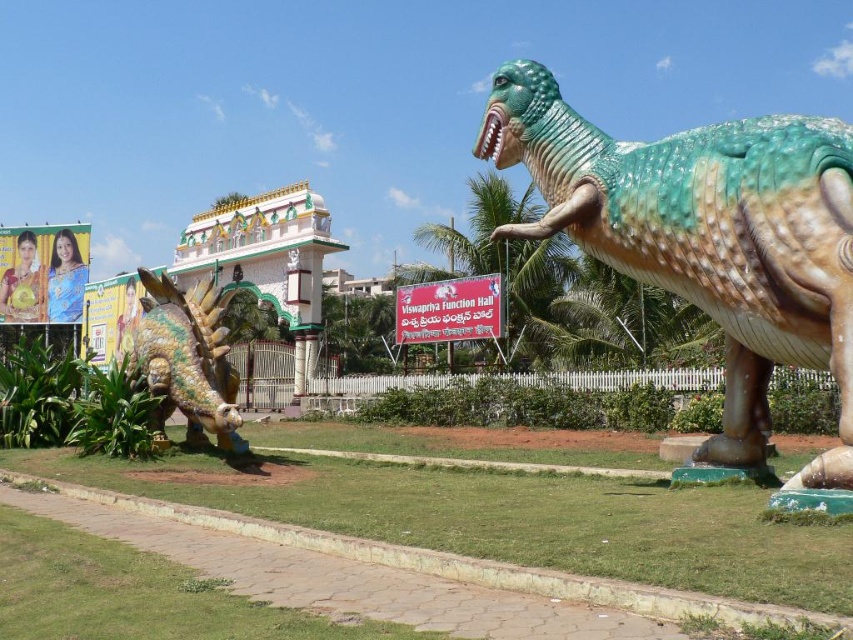
Is shiny green plastic dinosaur at right to the right of shiny gold plated dragon at center from the viewer's perspective?

Yes, shiny green plastic dinosaur at right is to the right of shiny gold plated dragon at center.

Does point (828, 360) lie in front of point (175, 307)?

Yes.

This screenshot has height=640, width=853. I want to click on shiny green plastic dinosaur at right, so click(706, 237).